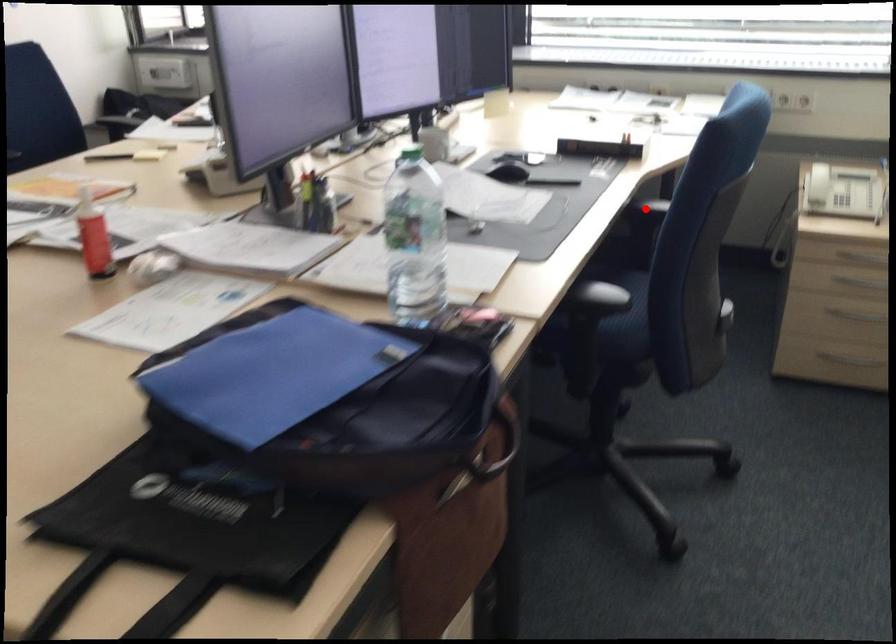
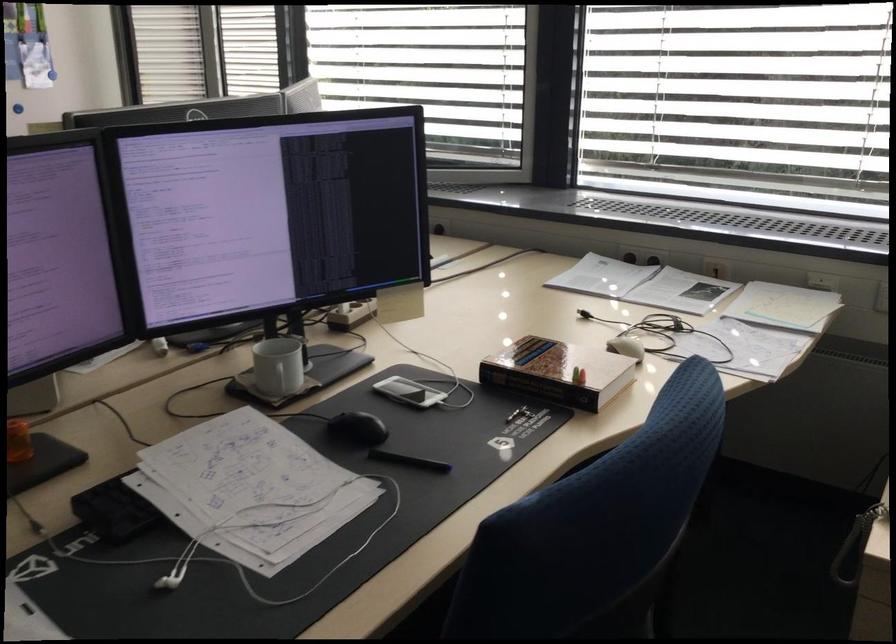
Question: I am providing you with two images of the same scene from different viewpoints. A red point is marked on the first image. Is the red point's position out of view in image 2?

Choices:
 (A) Yes
 (B) No

Answer: (A)